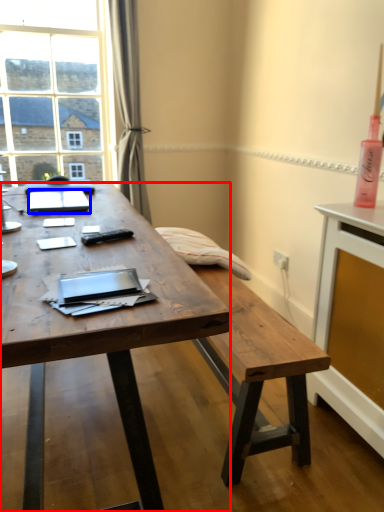
Question: Which object is closer to the camera taking this photo, desk (highlighted by a red box) or notebook (highlighted by a blue box)?

Choices:
 (A) desk
 (B) notebook

Answer: (A)